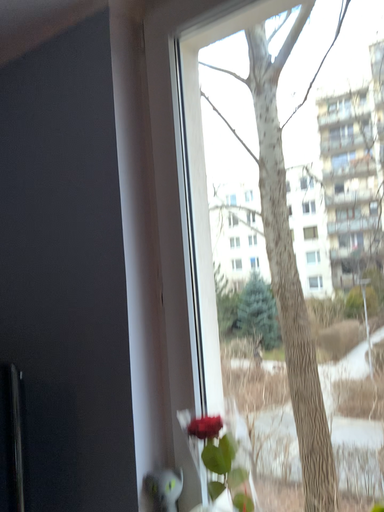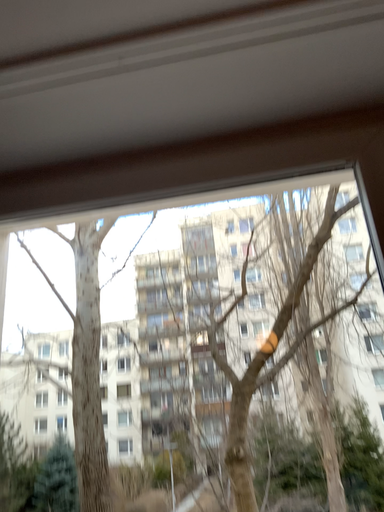
Question: How did the camera likely rotate when shooting the video?

Choices:
 (A) rotated downward
 (B) rotated upward

Answer: (B)